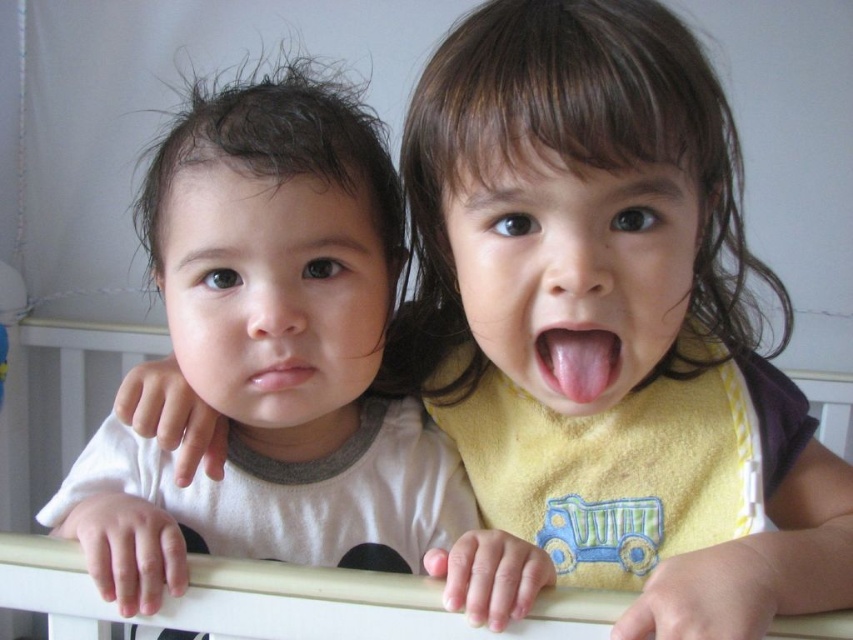
You are a photographer setting up a shot of two children leaning on a crib. You need to ensure that the yellow soft bib at center and the pink flesh tongue at center are both visible in the frame. Given their sizes, which object might require you to adjust your camera angle to include it fully?

The yellow soft bib at center has a greater height compared to the pink flesh tongue at center, so it might require adjusting the camera angle to ensure it is fully visible in the frame.

You are a parent trying to decide if the pink flesh tongue at center can fit inside the white plastic crib at center. Based on their sizes, what do you think?

The white plastic crib at center is bigger than the pink flesh tongue at center, so the pink flesh tongue at center can fit inside the white plastic crib at center.